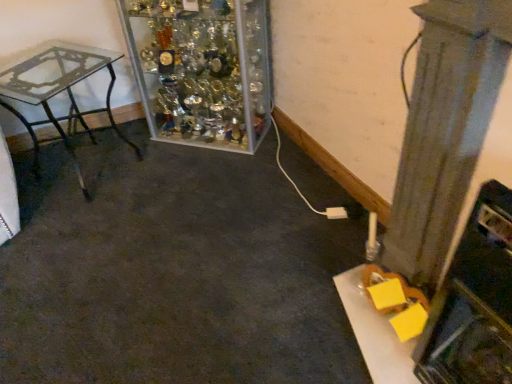
Question: Is clear glass table at left turned away from clear glass trophy case at upper center?

Choices:
 (A) yes
 (B) no

Answer: (B)

Question: Is clear glass table at left closer to camera compared to clear glass trophy case at upper center?

Choices:
 (A) no
 (B) yes

Answer: (B)

Question: From the image's perspective, is clear glass table at left on clear glass trophy case at upper center?

Choices:
 (A) no
 (B) yes

Answer: (A)

Question: Is clear glass table at left taller than clear glass trophy case at upper center?

Choices:
 (A) no
 (B) yes

Answer: (A)

Question: Does clear glass table at left have a larger size compared to clear glass trophy case at upper center?

Choices:
 (A) no
 (B) yes

Answer: (A)

Question: From the image's perspective, is clear glass trophy case at upper center above or below clear glass table at left?

Choices:
 (A) above
 (B) below

Answer: (A)

Question: Is point (241, 18) positioned closer to the camera than point (17, 115)?

Choices:
 (A) farther
 (B) closer

Answer: (B)

Question: Is clear glass trophy case at upper center taller or shorter than clear glass table at left?

Choices:
 (A) short
 (B) tall

Answer: (B)

Question: Based on their sizes in the image, would you say clear glass trophy case at upper center is bigger or smaller than clear glass table at left?

Choices:
 (A) small
 (B) big

Answer: (B)

Question: Choose the correct answer: Is smooth gray pillar at right inside clear glass trophy case at upper center or outside it?

Choices:
 (A) inside
 (B) outside

Answer: (B)

Question: Looking at their shapes, would you say smooth gray pillar at right is wider or thinner than clear glass trophy case at upper center?

Choices:
 (A) thin
 (B) wide

Answer: (A)

Question: Considering the positions of smooth gray pillar at right and clear glass trophy case at upper center in the image, is smooth gray pillar at right taller or shorter than clear glass trophy case at upper center?

Choices:
 (A) tall
 (B) short

Answer: (A)

Question: In the image, is smooth gray pillar at right positioned in front of or behind clear glass trophy case at upper center?

Choices:
 (A) behind
 (B) front

Answer: (B)

Question: In the image, is clear glass table at left positioned in front of or behind smooth gray pillar at right?

Choices:
 (A) front
 (B) behind

Answer: (B)

Question: Is point (69, 109) positioned closer to the camera than point (481, 62)?

Choices:
 (A) farther
 (B) closer

Answer: (A)